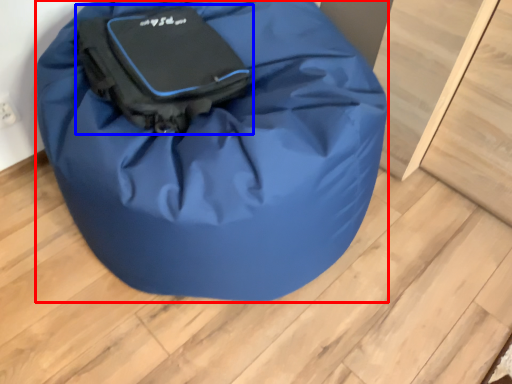
Question: Among these objects, which one is nearest to the camera, luggage and bags (highlighted by a red box) or luggage and bags (highlighted by a blue box)?

Choices:
 (A) luggage and bags
 (B) luggage and bags

Answer: (A)